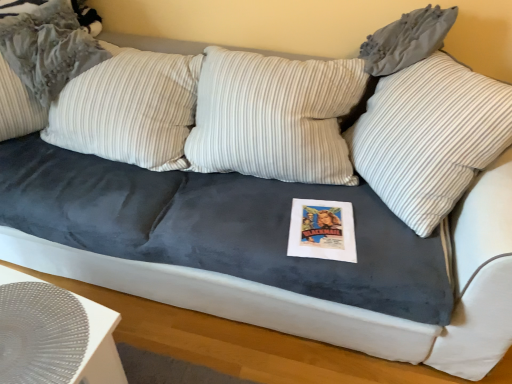
Question: From the image's perspective, is white striped pillow at upper center, the second pillow when ordered from left to right, over striped fabric pillow at upper left, which is the 1th pillow in left-to-right order?

Choices:
 (A) yes
 (B) no

Answer: (B)

Question: Are white striped pillow at upper center, the 1th pillow when ordered from right to left, and striped fabric pillow at upper left, which is the 1th pillow in left-to-right order, far apart?

Choices:
 (A) no
 (B) yes

Answer: (B)

Question: Is white striped pillow at upper center, the second pillow when ordered from left to right, further to the viewer compared to striped fabric pillow at upper left, the 2th pillow from the right?

Choices:
 (A) no
 (B) yes

Answer: (A)

Question: Could you tell me if white striped pillow at upper center, the 1th pillow when ordered from right to left, is turned towards striped fabric pillow at upper left, which is the 1th pillow in left-to-right order?

Choices:
 (A) yes
 (B) no

Answer: (B)

Question: Is white striped pillow at upper center, the second pillow when ordered from left to right, looking in the opposite direction of striped fabric pillow at upper left, the 2th pillow from the right?

Choices:
 (A) no
 (B) yes

Answer: (A)

Question: Relative to white striped pillow at upper center, the 1th pillow when ordered from right to left, is white textured placemat at lower left in front or behind?

Choices:
 (A) front
 (B) behind

Answer: (A)

Question: Is point (65, 357) positioned closer to the camera than point (419, 64)?

Choices:
 (A) closer
 (B) farther

Answer: (A)

Question: From the image's perspective, is white textured placemat at lower left located above or below white striped pillow at upper center, the 1th pillow when ordered from right to left?

Choices:
 (A) above
 (B) below

Answer: (B)

Question: Do you think white textured placemat at lower left is within white striped pillow at upper center, the 1th pillow when ordered from right to left, or outside of it?

Choices:
 (A) inside
 (B) outside

Answer: (B)

Question: From a real-world perspective, is striped fabric pillow at upper left, the 2th pillow from the right, above or below white textured placemat at lower left?

Choices:
 (A) below
 (B) above

Answer: (B)

Question: In the image, is striped fabric pillow at upper left, which is the 1th pillow in left-to-right order, positioned in front of or behind white textured placemat at lower left?

Choices:
 (A) front
 (B) behind

Answer: (B)

Question: Is striped fabric pillow at upper left, the 2th pillow from the right, inside the boundaries of white textured placemat at lower left, or outside?

Choices:
 (A) outside
 (B) inside

Answer: (A)

Question: From the image's perspective, is striped fabric pillow at upper left, which is the 1th pillow in left-to-right order, positioned above or below white textured placemat at lower left?

Choices:
 (A) below
 (B) above

Answer: (B)

Question: From their relative heights in the image, would you say striped fabric pillow at upper left, which is the 1th pillow in left-to-right order, is taller or shorter than white striped pillow at upper center, the second pillow when ordered from left to right?

Choices:
 (A) short
 (B) tall

Answer: (A)

Question: Choose the correct answer: Is striped fabric pillow at upper left, the 2th pillow from the right, inside white striped pillow at upper center, the 1th pillow when ordered from right to left, or outside it?

Choices:
 (A) outside
 (B) inside

Answer: (A)